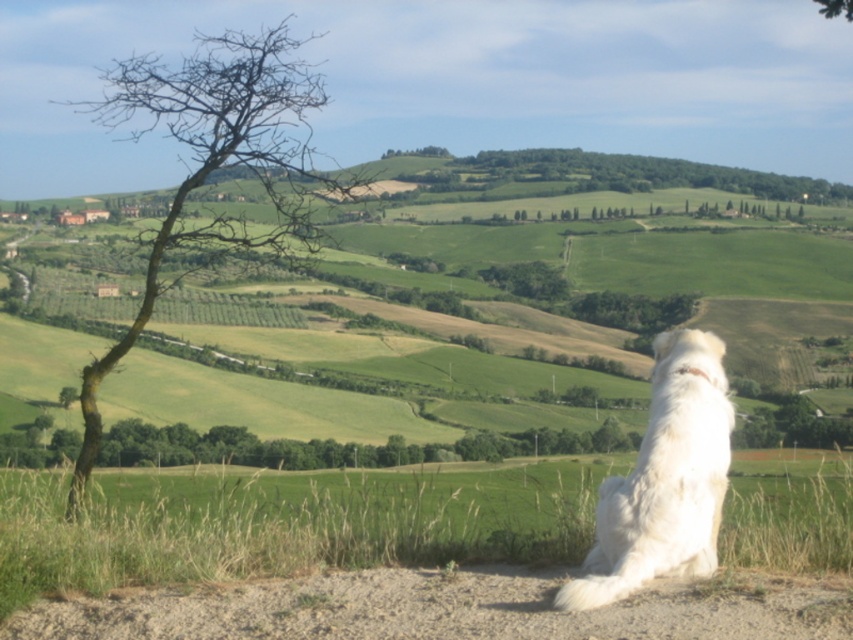
You are a photographer trying to capture the white fluffy dog at lower right without the bare branches at left in the background. Based on their positions, is this possible?

The bare branches at left is positioned over the white fluffy dog at lower right, so it would be difficult to capture the dog without the branches in the background unless you adjust your angle or move closer to the dog.

You are a hiker looking at the image and want to walk from the green grassy hillside at center to the bare branches at left. Which direction should you move relative to the current position?

You should move upwards because the green grassy hillside at center is below the bare branches at left, so moving upward will take you towards the bare branches at left.

You are a photographer planning to capture a landscape photo that includes both the green grassy hillside at center and the bare branches at left. Given their widths, which object should you position closer to the edge of the frame to ensure both fit in the shot?

Since the green grassy hillside at center has a lesser width compared to the bare branches at left, you should position the green grassy hillside at center closer to the edge of the frame to accommodate the wider bare branches at left and ensure both fit in the shot.